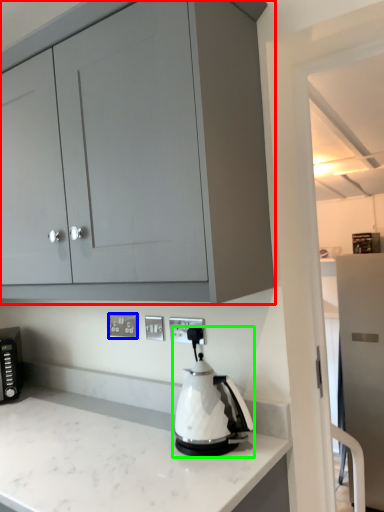
Question: Considering the real-world distances, which object is farthest from cabinetry (highlighted by a red box)? electric outlet (highlighted by a blue box) or kitchen appliance (highlighted by a green box)?

Choices:
 (A) electric outlet
 (B) kitchen appliance

Answer: (A)